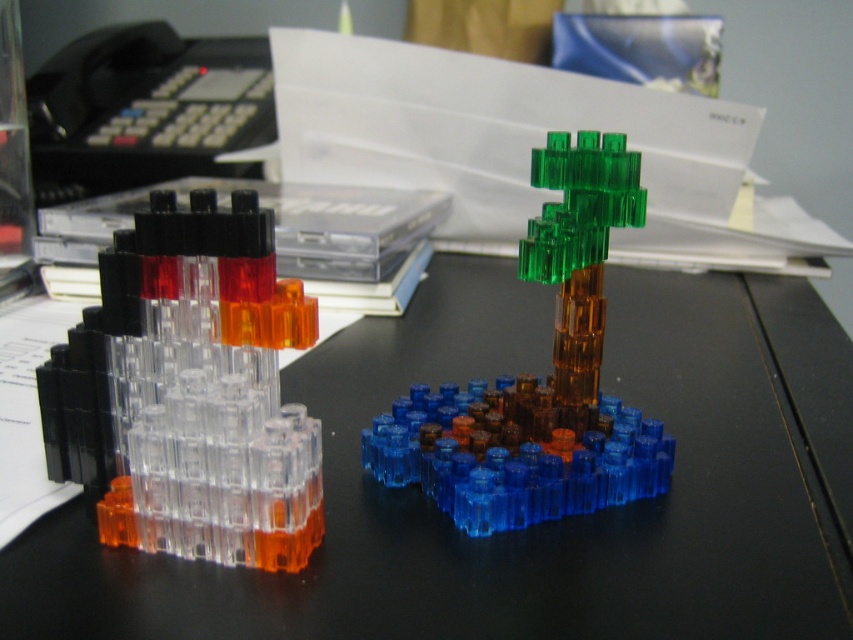
Question: Does transparent plastic blocks at center appear on the left side of transparent plastic rocket at left?

Choices:
 (A) yes
 (B) no

Answer: (B)

Question: Based on their relative distances, which object is farther from the transparent plastic tree at center?

Choices:
 (A) transparent plastic rocket at left
 (B) transparent plastic blocks at center

Answer: (A)

Question: Where is transparent plastic rocket at left located in relation to transparent plastic tree at center in the image?

Choices:
 (A) right
 (B) left

Answer: (B)

Question: From the image, what is the correct spatial relationship of transparent plastic blocks at center in relation to transparent plastic rocket at left?

Choices:
 (A) below
 (B) above

Answer: (A)

Question: Which point is closer to the camera?

Choices:
 (A) transparent plastic tree at center
 (B) transparent plastic blocks at center

Answer: (B)

Question: Considering the real-world distances, which object is closest to the transparent plastic rocket at left?

Choices:
 (A) transparent plastic blocks at center
 (B) transparent plastic tree at center

Answer: (B)